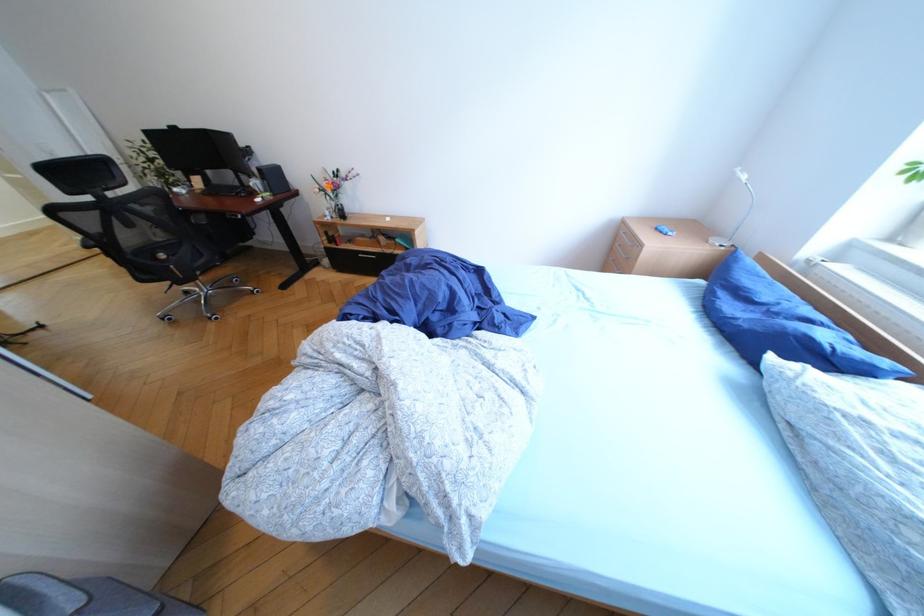
The width and height of the screenshot is (924, 616). What do you see at coordinates (367, 254) in the screenshot?
I see `the black drawer handle` at bounding box center [367, 254].